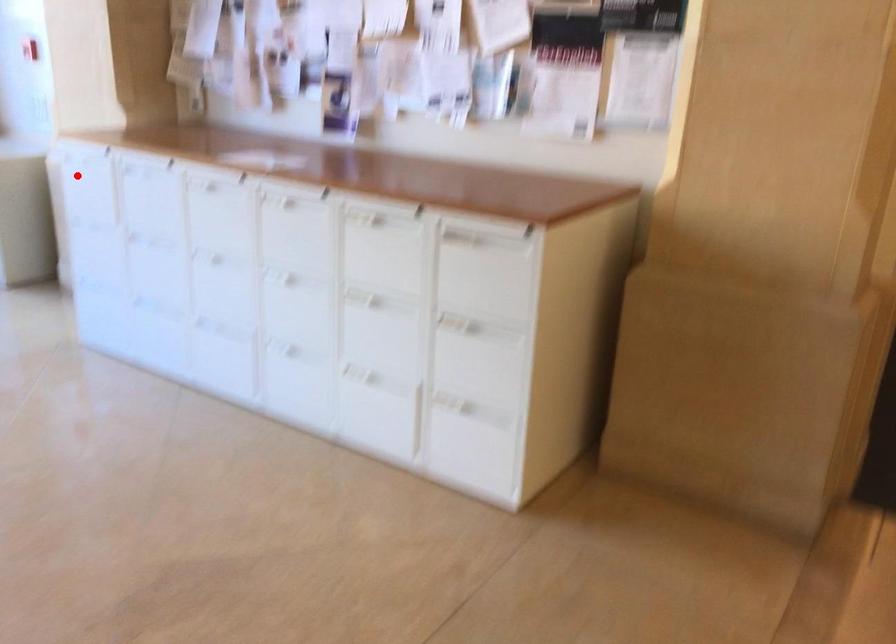
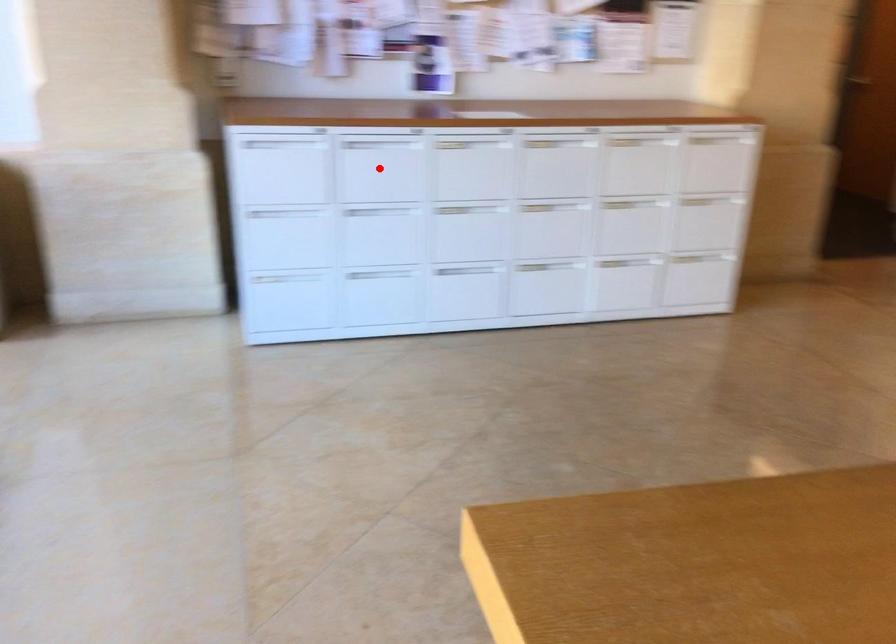
I am providing you with two images of the same scene from different viewpoints. A red point is marked on the first image and another point is marked on the second image. Is the marked point in image1 the same physical position as the marked point in image2?

No